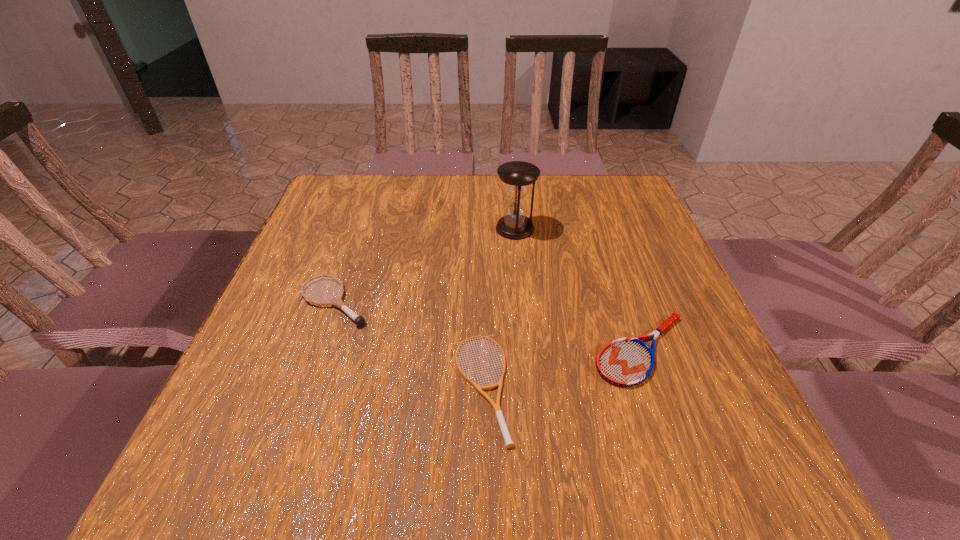
Where is `object that is the third nearest to the hourglass`? object that is the third nearest to the hourglass is located at coordinates (496, 407).

Locate an element on the screen. This screenshot has width=960, height=540. the closest object to the second tennis racket from right to left is located at coordinates (625, 362).

Identify which tennis racket is the second nearest to the second tennis racket from right to left. Please provide its 2D coordinates. Your answer should be formatted as a tuple, i.e. [(x, y)], where the tuple contains the x and y coordinates of a point satisfying the conditions above.

[(337, 301)]

Identify which tennis racket is the second closest to the second tennis racket from right to left. Please provide its 2D coordinates. Your answer should be formatted as a tuple, i.e. [(x, y)], where the tuple contains the x and y coordinates of a point satisfying the conditions above.

[(337, 301)]

Where is `free location that satisfies the following two spatial constraints: 1. on the back side of the second tennis racket from left to right; 2. on the left side of the tallest object`? free location that satisfies the following two spatial constraints: 1. on the back side of the second tennis racket from left to right; 2. on the left side of the tallest object is located at coordinates (480, 228).

At what (x,y) coordinates should I click in order to perform the action: click on vacant area in the image that satisfies the following two spatial constraints: 1. on the front side of the rightmost tennis racket; 2. on the right side of the leftmost object. Please return your answer as a coordinate pair (x, y). Looking at the image, I should click on coord(318,349).

You are a GUI agent. You are given a task and a screenshot of the screen. Output one action in this format:
    pyautogui.click(x=<x>, y=<y>)
    Task: Click on the free point that satisfies the following two spatial constraints: 1. on the back side of the rightmost object; 2. on the left side of the second tennis racket from left to right
    
    Given the screenshot: What is the action you would take?
    pyautogui.click(x=480, y=349)